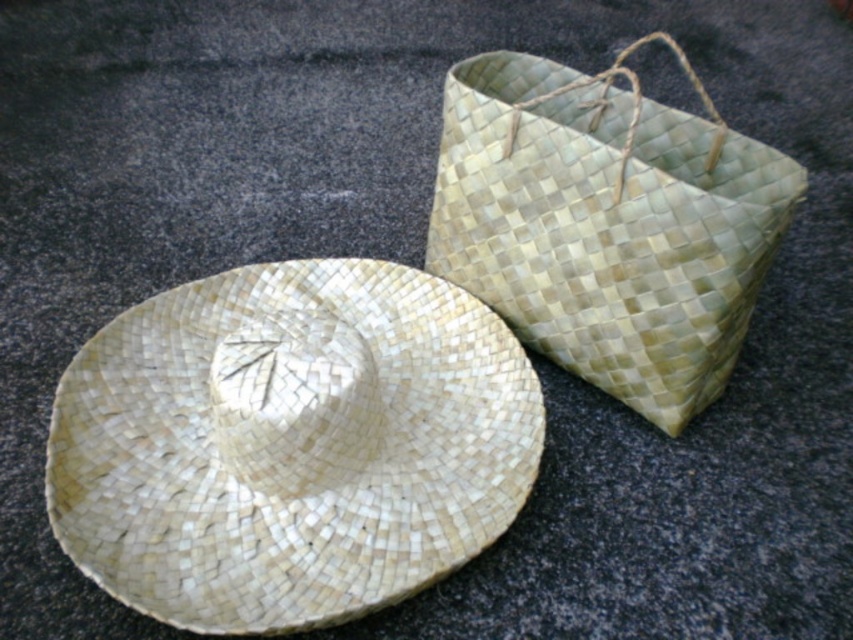
You are a delivery person who needs to place a package between the natural woven straw hat at center and the green woven basket at upper right. Which object should you position the package closer to if you want to ensure it doesn

The natural woven straw hat at center might be wider than the green woven basket at upper right, so positioning the package closer to the green woven basket at upper right would leave more space between them.

You are standing in a sunny garden and see the natural woven straw hat at center and the green woven basket at upper right. Which item is closer to you?

The natural woven straw hat at center is closer to you because it is positioned under the green woven basket at upper right, indicating it is in front.

You are standing in a sunny garden and need to choose between the natural woven straw hat at center and the green woven basket at upper right to protect yourself from the sun. Which item would provide better sun protection based on their placement in the image?

The natural woven straw hat at center has a lesser height compared to the green woven basket at upper right. However, the hat is designed to cover the head and face, making it more effective for sun protection compared to the basket.